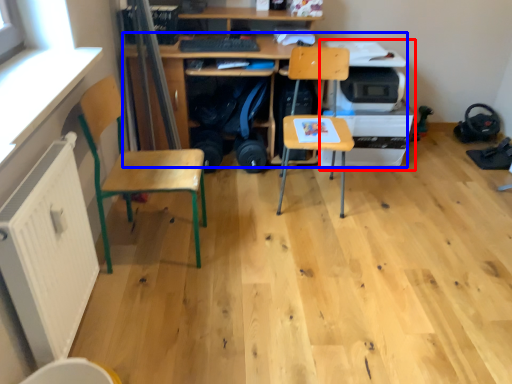
Question: Which of the following is the farthest to the observer, printer (highlighted by a red box) or desk (highlighted by a blue box)?

Choices:
 (A) printer
 (B) desk

Answer: (A)